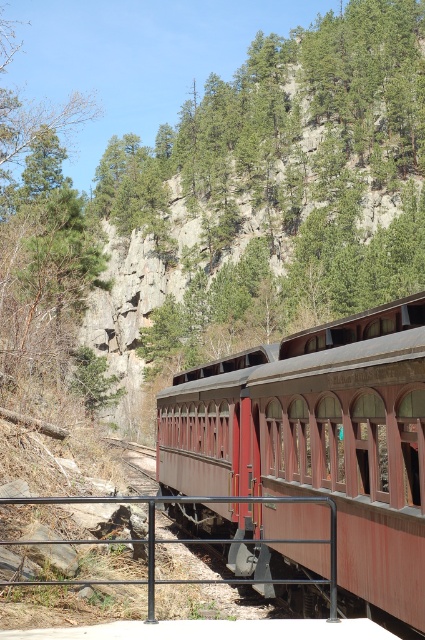
You are a passenger on a train traveling through a mountainous area. You look out the window and see the matte red train car at center. Based on its position, can you estimate where it is located relative to the train track?

The matte red train car at center is located at coordinates point (320,442), which places it centrally along the train track winding through the mountainous area.

From the picture: You are standing at the point closest to the train in the image. Which of the two points, point [214,461] or point [130,582], is farther away from you?

Point [214,461] is farther away from you because it is behind point [130,582], which is closer to the train.